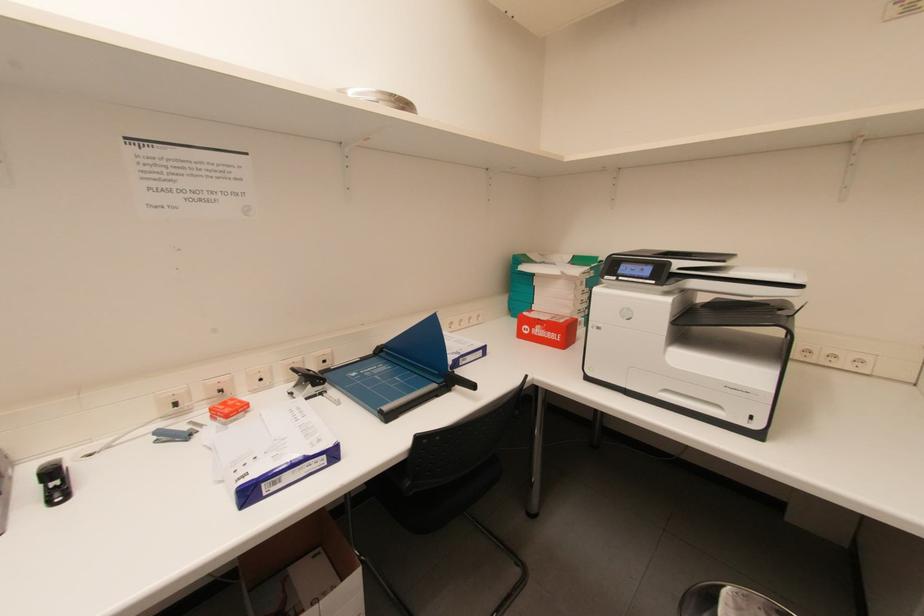
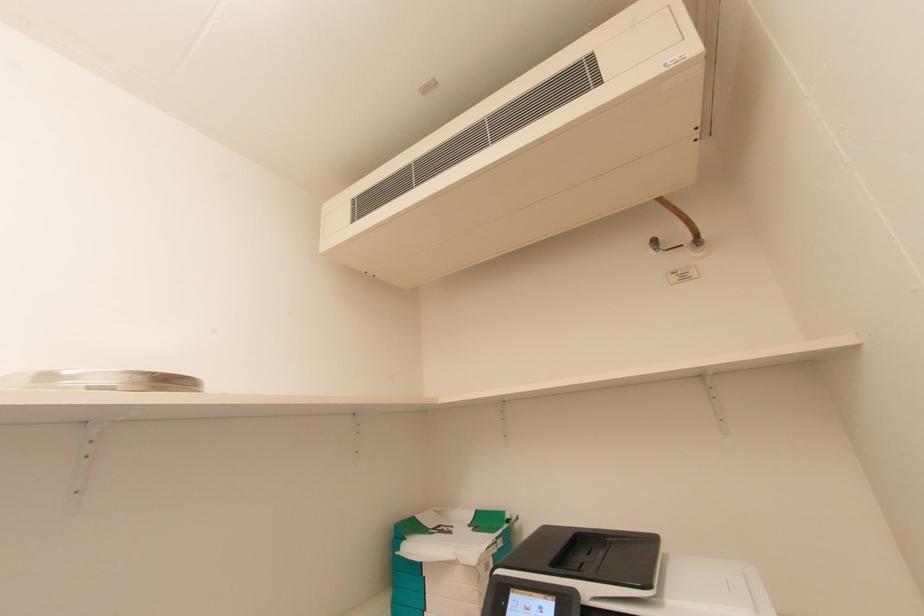
First-person continuous shooting, in which direction is the camera rotating?

The rotation direction of the camera is right-up.